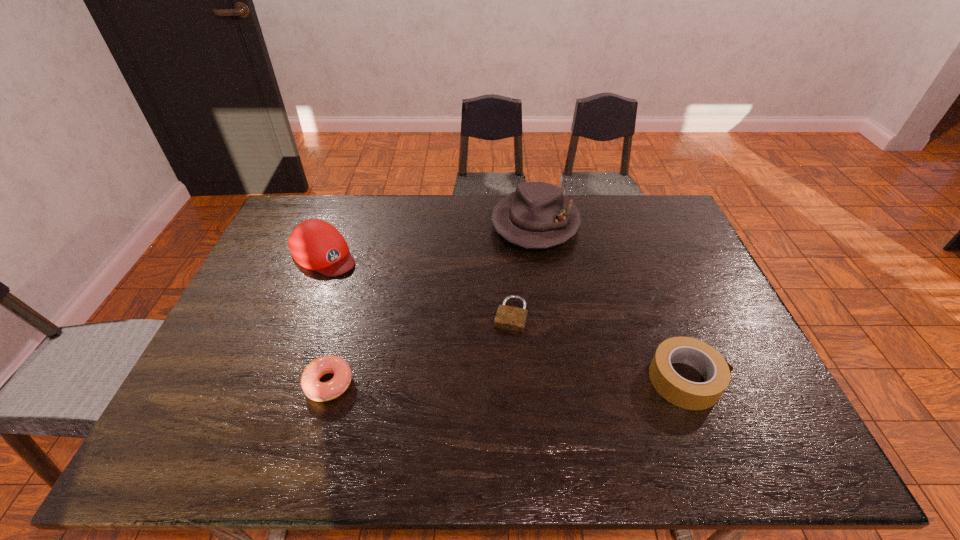
At what (x,y) coordinates should I click in order to perform the action: click on free spot between the tallest object and the second tallest object. Please return your answer as a coordinate pair (x, y). Looking at the image, I should click on (429, 239).

Image resolution: width=960 pixels, height=540 pixels. Identify the location of vacant area that lies between the hat and the baseball cap. (429, 239).

What are the coordinates of `free area in between the duct tape and the doughnut` in the screenshot? It's located at click(508, 382).

Find the location of a particular element. This screenshot has width=960, height=540. free space between the duct tape and the tallest object is located at coordinates (611, 302).

Locate an element on the screen. The image size is (960, 540). empty space that is in between the hat and the doughnut is located at coordinates (432, 303).

Find the location of a particular element. The height and width of the screenshot is (540, 960). vacant area that lies between the tallest object and the third shortest object is located at coordinates (611, 302).

I want to click on blank region between the hat and the fourth tallest object, so click(x=432, y=303).

The height and width of the screenshot is (540, 960). I want to click on vacant region between the doughnut and the tallest object, so click(432, 303).

I want to click on vacant space that is in between the fourth shortest object and the shortest object, so click(417, 285).

At what (x,y) coordinates should I click in order to perform the action: click on vacant space that's between the shortest object and the hat. Please return your answer as a coordinate pair (x, y). This screenshot has width=960, height=540. Looking at the image, I should click on (523, 269).